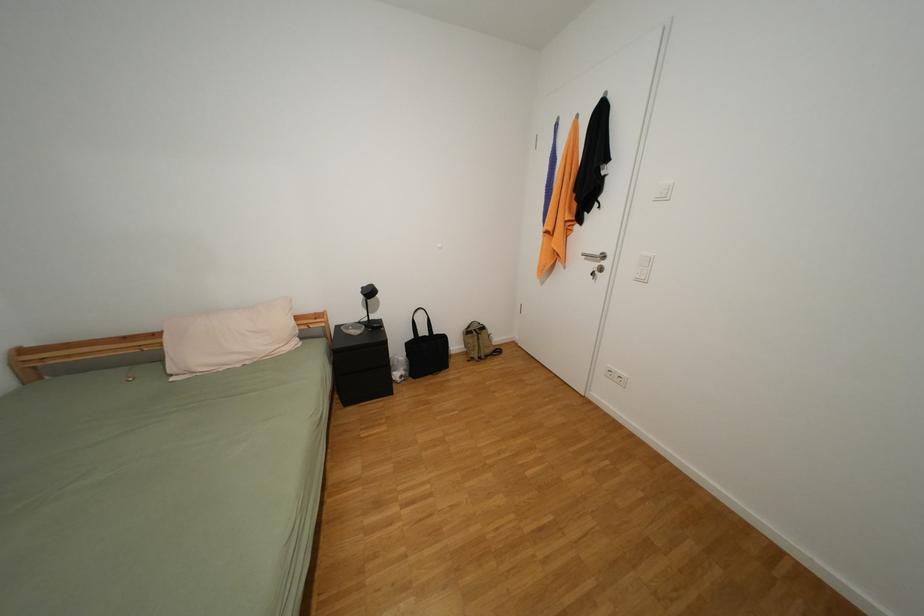
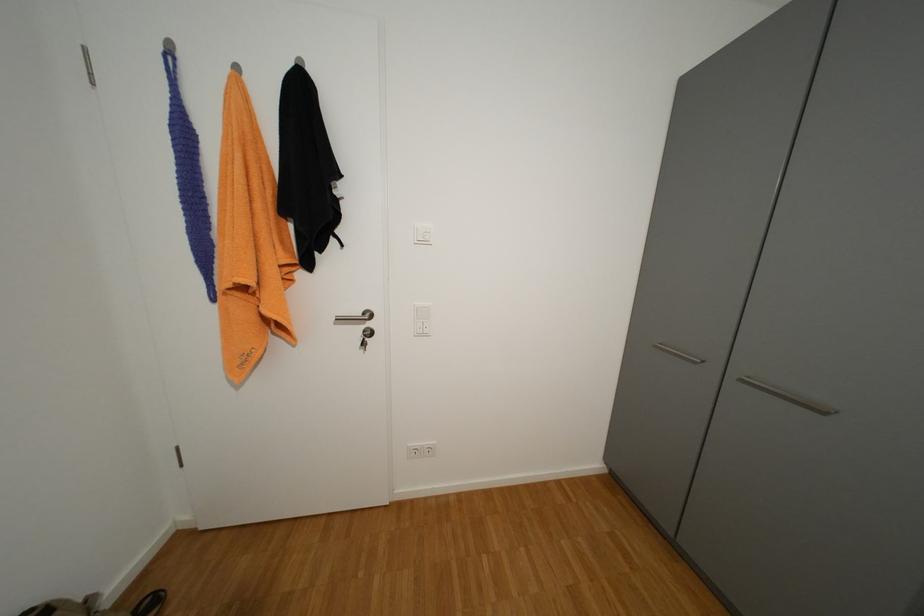
Question: The camera is either moving clockwise (left) or counter-clockwise (right) around the object. The first image is from the beginning of the video and the second image is from the end. Is the camera moving left or right when shooting the video?

Choices:
 (A) Left
 (B) Right

Answer: (A)